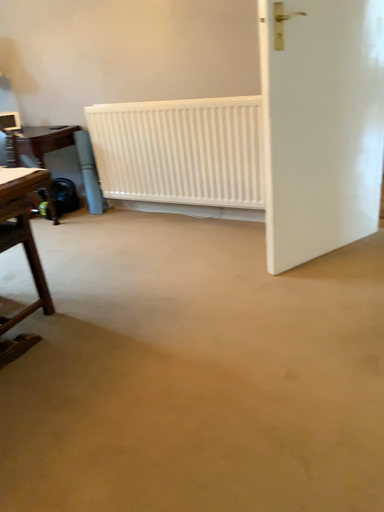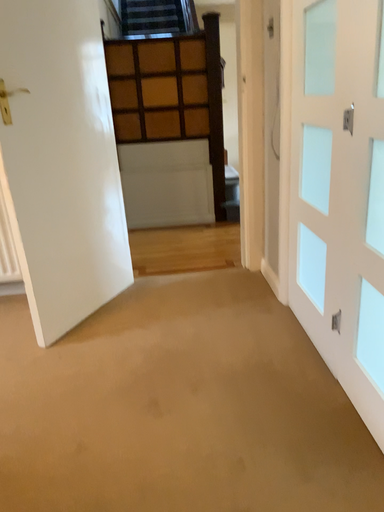
Question: How did the camera likely rotate when shooting the video?

Choices:
 (A) rotated upward
 (B) rotated downward

Answer: (A)